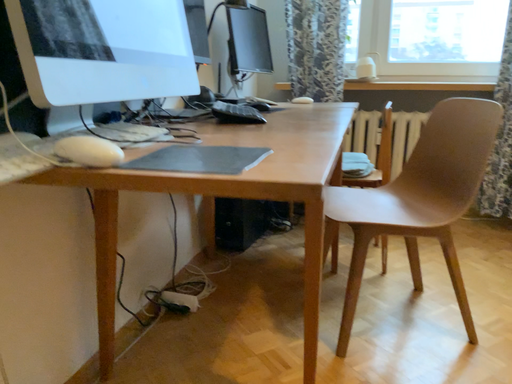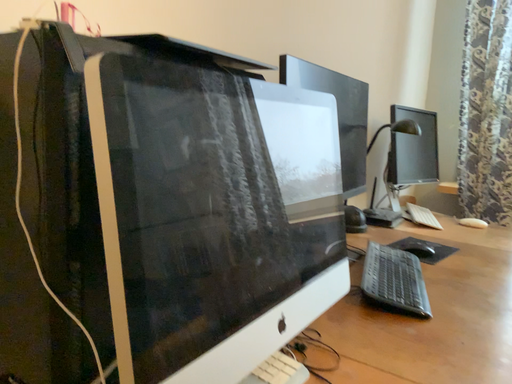
Question: Which way did the camera rotate in the video?

Choices:
 (A) rotated upward
 (B) rotated downward

Answer: (A)